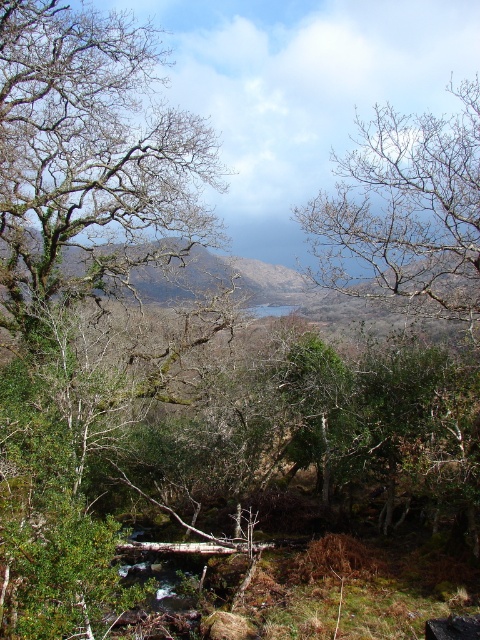
Question: Which object is farther from the camera taking this photo?

Choices:
 (A) green mossy hillside at center
 (B) bare branches at upper center

Answer: (B)

Question: Which of the following is the closest to the observer?

Choices:
 (A) (251, 269)
 (B) (12, 3)
 (C) (410, 218)

Answer: (C)

Question: Which point is farther to the camera?

Choices:
 (A) (133, 284)
 (B) (405, 240)

Answer: (A)

Question: Is green mossy tree at left positioned before bare branches at upper center?

Choices:
 (A) yes
 (B) no

Answer: (B)

Question: Can you confirm if green mossy tree at left is positioned to the right of bare branches at upper center?

Choices:
 (A) yes
 (B) no

Answer: (B)

Question: Does green mossy tree at left have a greater width compared to bare branches at upper center?

Choices:
 (A) yes
 (B) no

Answer: (A)